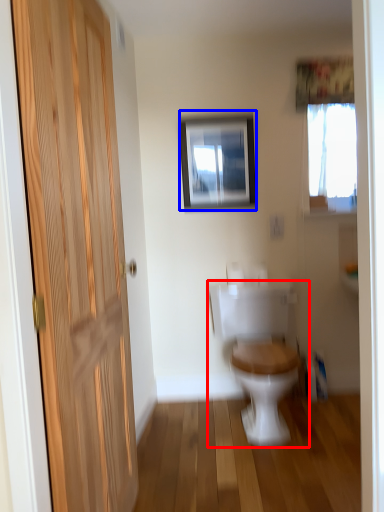
Question: Which object is further to the camera taking this photo, toilet (highlighted by a red box) or picture frame (highlighted by a blue box)?

Choices:
 (A) toilet
 (B) picture frame

Answer: (B)